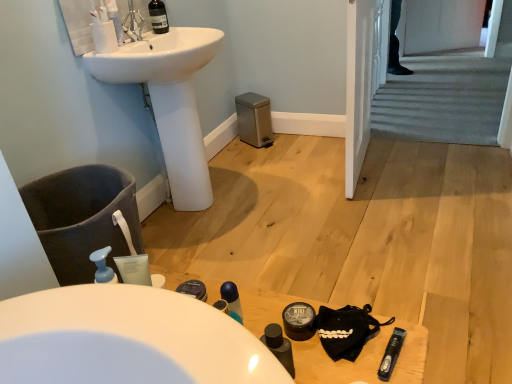
Question: Is transparent plastic mouthwash at lower right, marked as the first mouthwash in a front-to-back arrangement, oriented away from white glossy sink at upper left?

Choices:
 (A) no
 (B) yes

Answer: (A)

Question: Can you confirm if transparent plastic mouthwash at lower right, the 1th mouthwash from the right, is smaller than white glossy sink at upper left?

Choices:
 (A) yes
 (B) no

Answer: (A)

Question: Does transparent plastic mouthwash at lower right, acting as the first mouthwash starting from the bottom, contain white glossy sink at upper left?

Choices:
 (A) no
 (B) yes

Answer: (A)

Question: Can you confirm if transparent plastic mouthwash at lower right, acting as the first mouthwash starting from the bottom, is positioned to the left of white glossy sink at upper left?

Choices:
 (A) no
 (B) yes

Answer: (A)

Question: Are transparent plastic mouthwash at lower right, marked as the first mouthwash in a front-to-back arrangement, and white glossy sink at upper left far apart?

Choices:
 (A) no
 (B) yes

Answer: (B)

Question: Based on their sizes in the image, would you say matte black container at lower center is bigger or smaller than transparent glass wine bottle at upper center?

Choices:
 (A) small
 (B) big

Answer: (A)

Question: Relative to transparent glass wine bottle at upper center, is matte black container at lower center in front or behind?

Choices:
 (A) behind
 (B) front

Answer: (B)

Question: In terms of height, does matte black container at lower center look taller or shorter compared to transparent glass wine bottle at upper center?

Choices:
 (A) tall
 (B) short

Answer: (B)

Question: From the image's perspective, is matte black container at lower center above or below transparent glass wine bottle at upper center?

Choices:
 (A) below
 (B) above

Answer: (A)

Question: Choose the correct answer: Is black matte table at lower center inside matte black container at lower center or outside it?

Choices:
 (A) inside
 (B) outside

Answer: (B)

Question: Is black matte table at lower center bigger or smaller than matte black container at lower center?

Choices:
 (A) big
 (B) small

Answer: (A)

Question: Considering the relative positions of black matte table at lower center and matte black container at lower center in the image provided, is black matte table at lower center to the left or to the right of matte black container at lower center?

Choices:
 (A) left
 (B) right

Answer: (A)

Question: Is point (244, 322) positioned closer to the camera than point (297, 329)?

Choices:
 (A) closer
 (B) farther

Answer: (B)

Question: Looking at their shapes, would you say transparent glass wine bottle at upper center is wider or thinner than carpeted stairs at center?

Choices:
 (A) wide
 (B) thin

Answer: (B)

Question: Considering the positions of transparent glass wine bottle at upper center and carpeted stairs at center in the image, is transparent glass wine bottle at upper center taller or shorter than carpeted stairs at center?

Choices:
 (A) tall
 (B) short

Answer: (A)